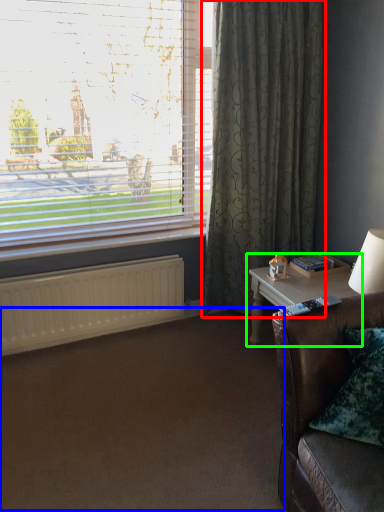
Question: Which is nearer to the curtain (highlighted by a red box)? plain (highlighted by a blue box) or table (highlighted by a green box).

Choices:
 (A) plain
 (B) table

Answer: (B)